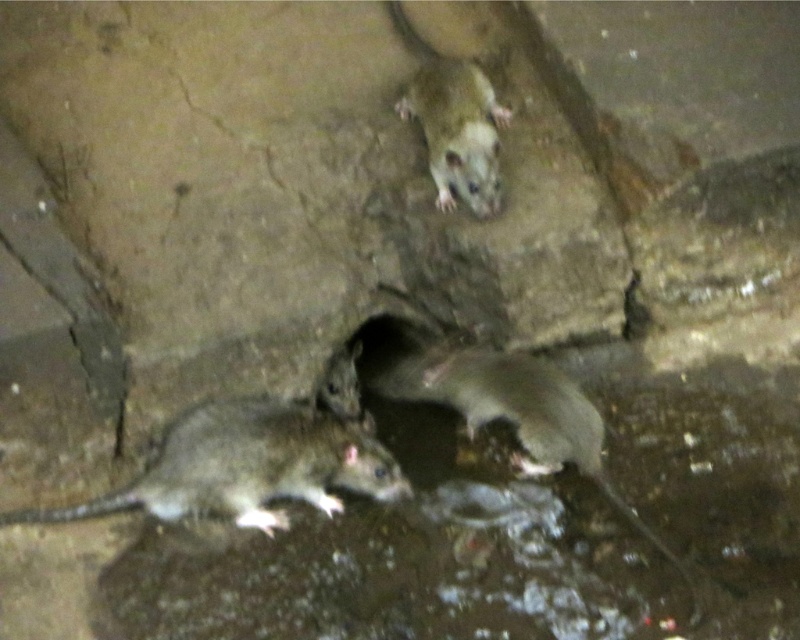
You are a small animal that is 0.2 meters tall. You want to move from your current position to the point marked by the coordinates point (248, 401). Can you safely reach that point without any obstacles blocking your path?

The point (248, 401) is 1.88 meters away from your current position. Since you are only 0.2 meters tall, the distance is manageable, and there are no mentioned obstacles in the scene description, so you can safely reach the point.

You are a cat trying to spot prey in this dimly lit environment. Which mouse is closer to you, the gray matte mouse at lower left or the fuzzy gray mouse at upper center?

The gray matte mouse at lower left is closer to you because it is positioned in front of the fuzzy gray mouse at upper center.

You are observing the rats in the dimly lit environment. Which mouse is positioned to the right of the other? Specifically, is the gray fur mouse at lower center to the right or left of the fuzzy gray mouse at upper center?

The gray fur mouse at lower center is to the right of the fuzzy gray mouse at upper center.